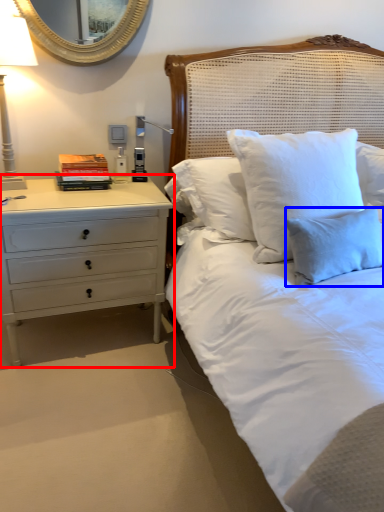
Question: Which point is closer to the camera, chest of drawers (highlighted by a red box) or pillow (highlighted by a blue box)?

Choices:
 (A) chest of drawers
 (B) pillow

Answer: (B)